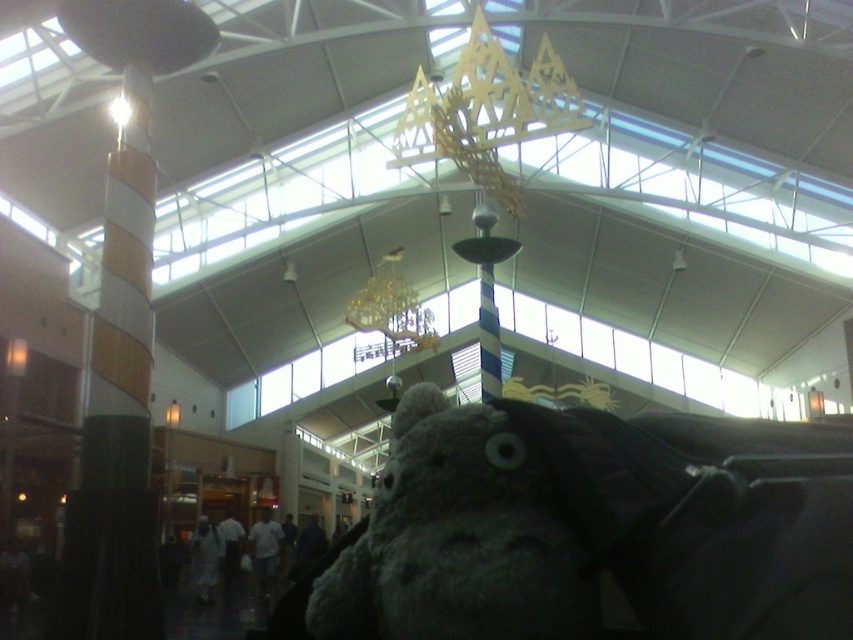
Looking at this image, you are a customer in the mall and want to take a photo of the gray plush toy at center and the striped wood pillar at left. Which object should you focus on to ensure both are in the frame?

The gray plush toy at center is smaller than the striped wood pillar at left, so you should focus on the striped wood pillar at left to ensure both are in the frame.

You are standing in the modern building and want to place a new poster between the gray plush toy at center and the striped wood pillar at left. Where should you place it to ensure it is between them?

Place the poster between the gray plush toy at center and the striped wood pillar at left, positioning it to the right of the striped wood pillar at left and to the left of the gray plush toy at center since the gray plush toy at center is located to the right of the striped wood pillar at left.